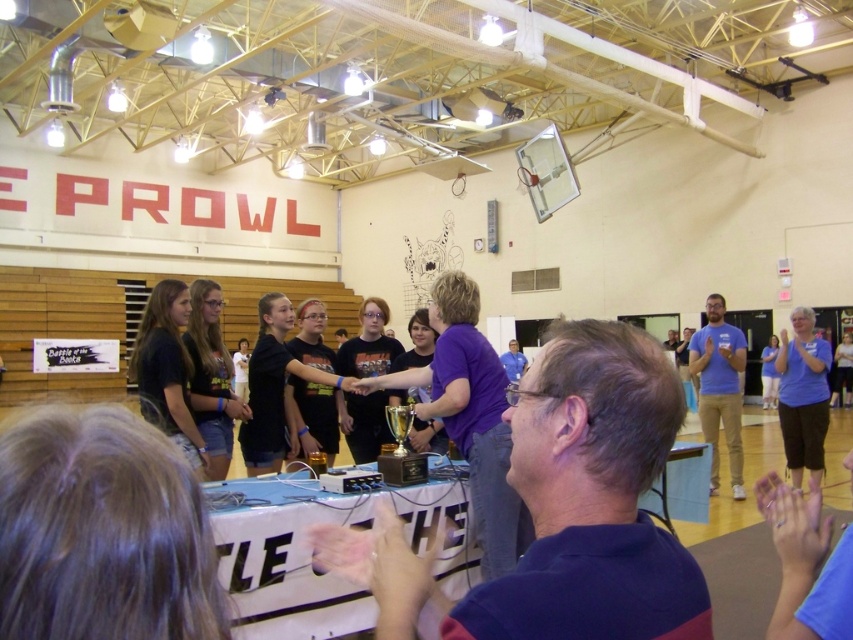
Which is above, blue fabric shirt at right or blue cotton shirt at right?

Positioned higher is blue fabric shirt at right.

Is blue fabric shirt at right positioned before blue cotton shirt at right?

Yes.

Between point (804, 336) and point (715, 365), which one is positioned behind?

The point (715, 365) is behind.

This screenshot has width=853, height=640. I want to click on blue fabric shirt at right, so click(x=804, y=396).